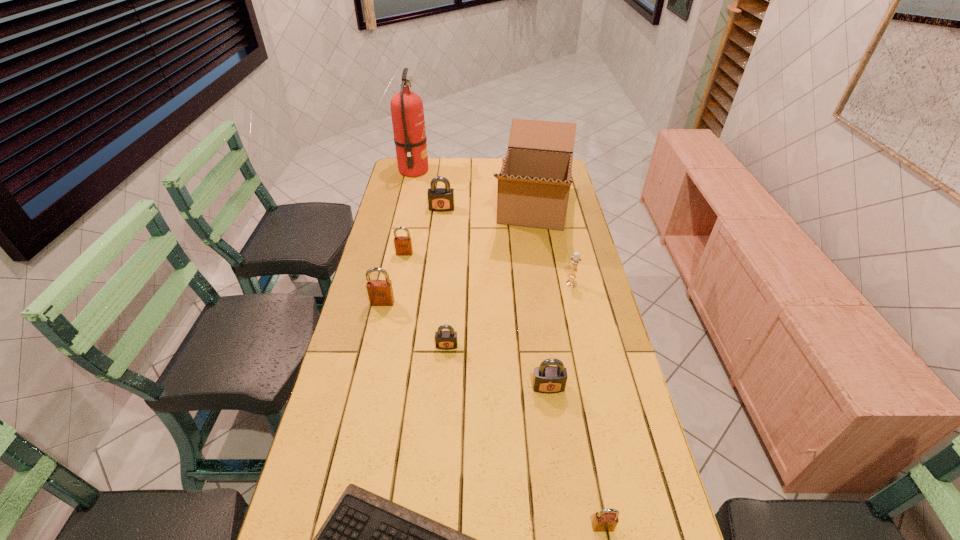
Identify the location of vacant region located 0.340m on the left of the candle holder. This screenshot has height=540, width=960. (467, 284).

This screenshot has width=960, height=540. What are the coordinates of `vacant point located on the front-facing side of the second smallest brown padlock` in the screenshot? It's located at (401, 272).

At what (x,y) coordinates should I click in order to perform the action: click on vacant position located 0.130m on the front of the fifth farthest padlock near the keyhole. Please return your answer as a coordinate pair (x, y). Looking at the image, I should click on (556, 440).

The height and width of the screenshot is (540, 960). In order to click on blank space located 0.260m on the front of the seventh farthest object near the keyhole in this screenshot , I will do `click(441, 433)`.

The image size is (960, 540). I want to click on fire extinguisher located at the far edge, so click(407, 112).

This screenshot has height=540, width=960. In order to click on box that is at the far edge in this screenshot , I will do `click(534, 183)`.

The width and height of the screenshot is (960, 540). Identify the location of fire extinguisher located in the left edge section of the desktop. (407, 112).

Locate an element on the screen. The height and width of the screenshot is (540, 960). box that is at the right edge is located at coordinates (534, 183).

Where is `candle holder present at the right edge`? This screenshot has height=540, width=960. candle holder present at the right edge is located at coordinates (576, 259).

Find the location of a particular element. The image size is (960, 540). padlock located in the right edge section of the desktop is located at coordinates (606, 520).